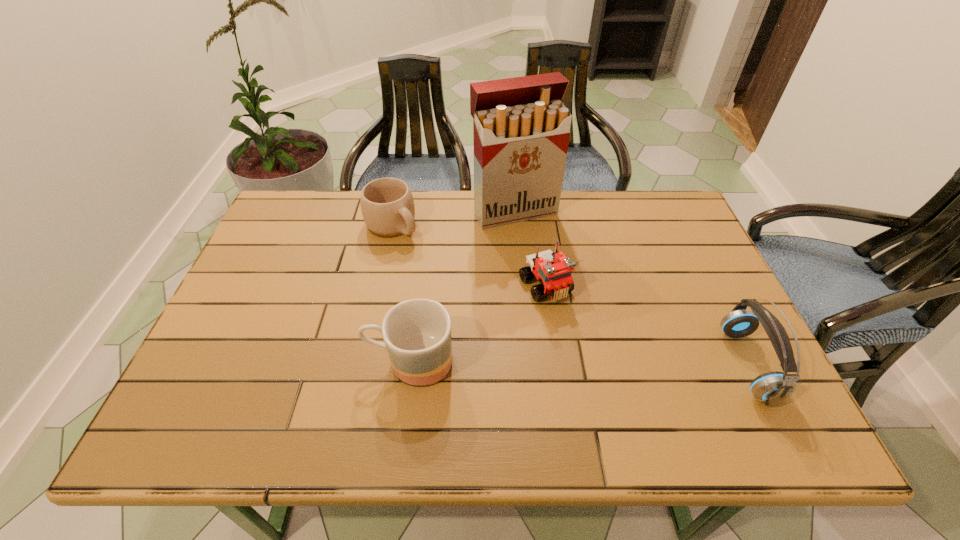
In order to click on free space at the near left corner of the desktop in this screenshot , I will do `click(216, 369)`.

Locate an element on the screen. The width and height of the screenshot is (960, 540). free space that is in between the nearer mug and the farther mug is located at coordinates (401, 293).

This screenshot has width=960, height=540. I want to click on vacant space that's between the headset and the tallest object, so click(x=631, y=288).

This screenshot has height=540, width=960. What are the coordinates of `unoccupied position between the Lego and the cigarette case` in the screenshot? It's located at (530, 249).

At what (x,y) coordinates should I click in order to perform the action: click on blank region between the cigarette case and the Lego. Please return your answer as a coordinate pair (x, y). This screenshot has width=960, height=540. Looking at the image, I should click on (530, 249).

Where is `empty location between the Lego and the tallest object`? empty location between the Lego and the tallest object is located at coordinates (530, 249).

Identify the location of free point between the rightmost object and the nearer mug. Image resolution: width=960 pixels, height=540 pixels. point(579,363).

This screenshot has height=540, width=960. Find the location of `free point between the farther mug and the Lego`. free point between the farther mug and the Lego is located at coordinates (468, 255).

Where is `free area in between the third farthest object and the rightmost object`? The width and height of the screenshot is (960, 540). free area in between the third farthest object and the rightmost object is located at coordinates (646, 325).

Locate an element on the screen. Image resolution: width=960 pixels, height=540 pixels. vacant area between the nearer mug and the tallest object is located at coordinates (463, 286).